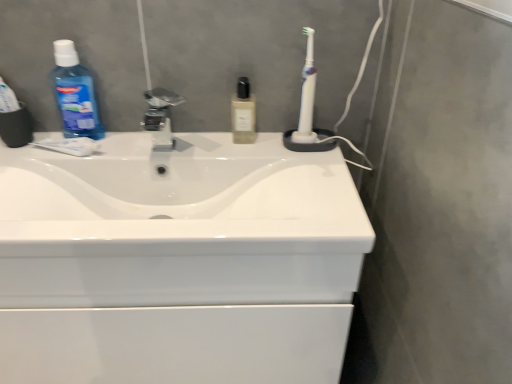
Question: Does blue translucent mouthwash at left have a greater width compared to translucent glass bottle at center?

Choices:
 (A) no
 (B) yes

Answer: (B)

Question: Does blue translucent mouthwash at left have a lesser width compared to translucent glass bottle at center?

Choices:
 (A) yes
 (B) no

Answer: (B)

Question: Is blue translucent mouthwash at left oriented away from translucent glass bottle at center?

Choices:
 (A) no
 (B) yes

Answer: (A)

Question: Is blue translucent mouthwash at left surrounding translucent glass bottle at center?

Choices:
 (A) no
 (B) yes

Answer: (A)

Question: Is blue translucent mouthwash at left shorter than translucent glass bottle at center?

Choices:
 (A) no
 (B) yes

Answer: (A)

Question: From the image's perspective, relative to white plastic toothbrush at upper right, is blue translucent mouthwash at left above or below?

Choices:
 (A) above
 (B) below

Answer: (A)

Question: Considering the positions of point (73, 52) and point (313, 89), is point (73, 52) closer or farther from the camera than point (313, 89)?

Choices:
 (A) closer
 (B) farther

Answer: (A)

Question: Is blue translucent mouthwash at left to the left or to the right of white plastic toothbrush at upper right in the image?

Choices:
 (A) left
 (B) right

Answer: (A)

Question: Considering the positions of blue translucent mouthwash at left and white plastic toothbrush at upper right in the image, is blue translucent mouthwash at left bigger or smaller than white plastic toothbrush at upper right?

Choices:
 (A) small
 (B) big

Answer: (B)

Question: Is point (105, 196) closer or farther from the camera than point (168, 127)?

Choices:
 (A) closer
 (B) farther

Answer: (A)

Question: From the image's perspective, is white glossy sink at center positioned above or below satin nickel faucet at center?

Choices:
 (A) below
 (B) above

Answer: (A)

Question: From a real-world perspective, is white glossy sink at center positioned above or below satin nickel faucet at center?

Choices:
 (A) below
 (B) above

Answer: (A)

Question: Which is correct: white glossy sink at center is inside satin nickel faucet at center, or outside of it?

Choices:
 (A) outside
 (B) inside

Answer: (A)

Question: Does point (5, 261) appear closer or farther from the camera than point (97, 129)?

Choices:
 (A) closer
 (B) farther

Answer: (A)

Question: From the image's perspective, relative to blue translucent mouthwash at left, is white glossy sink at center above or below?

Choices:
 (A) above
 (B) below

Answer: (B)